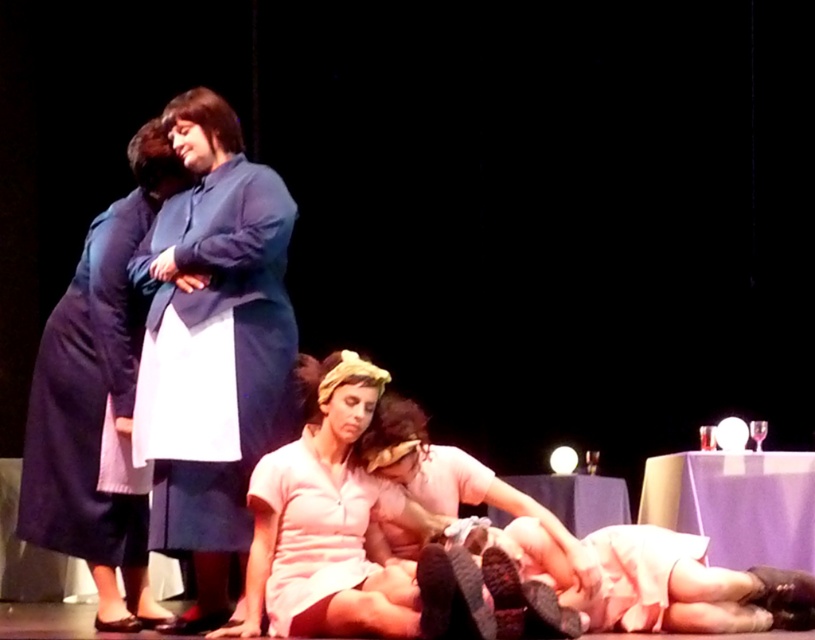
Question: Is white matte dress at center to the right of pink satin dress at lower center from the viewer's perspective?

Choices:
 (A) yes
 (B) no

Answer: (B)

Question: Which point appears closest to the camera in this image?

Choices:
 (A) (472, 488)
 (B) (157, 417)
 (C) (108, 262)

Answer: (B)

Question: Is the position of white matte dress at center more distant than that of white matte dress at lower center?

Choices:
 (A) no
 (B) yes

Answer: (A)

Question: Which point is farther to the camera?

Choices:
 (A) blue fabric coat at upper left
 (B) matte blue dress at upper left

Answer: (B)

Question: Is white matte dress at center smaller than white matte dress at lower center?

Choices:
 (A) yes
 (B) no

Answer: (B)

Question: Among these points, which one is nearest to the camera?

Choices:
 (A) (170, 404)
 (B) (141, 308)
 (C) (252, 474)

Answer: (C)